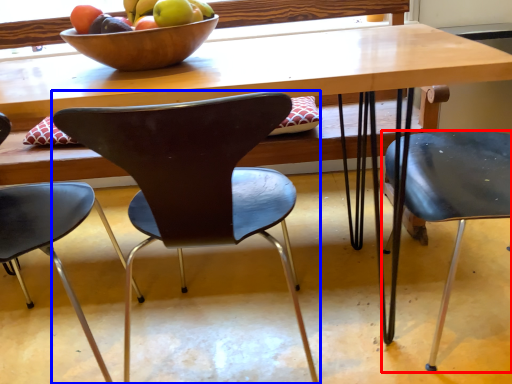
Question: Which object appears farthest to the camera in this image, chair (highlighted by a red box) or chair (highlighted by a blue box)?

Choices:
 (A) chair
 (B) chair

Answer: (A)